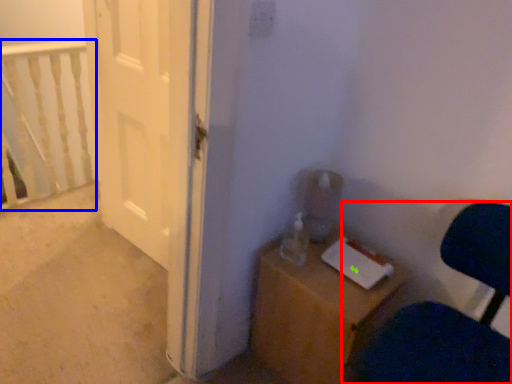
Question: Which object appears closest to the camera in this image, chair (highlighted by a red box) or rail (highlighted by a blue box)?

Choices:
 (A) chair
 (B) rail

Answer: (A)